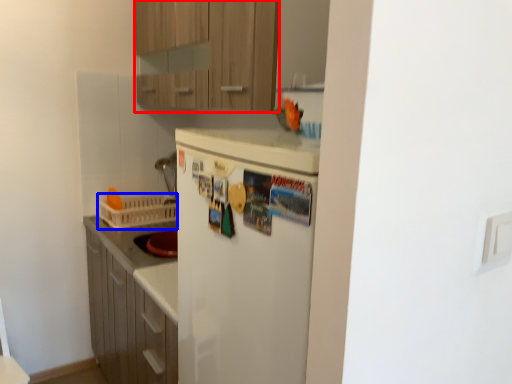
Question: Which of the following is the closest to the observer, cabinetry (highlighted by a red box) or basket (highlighted by a blue box)?

Choices:
 (A) cabinetry
 (B) basket

Answer: (A)